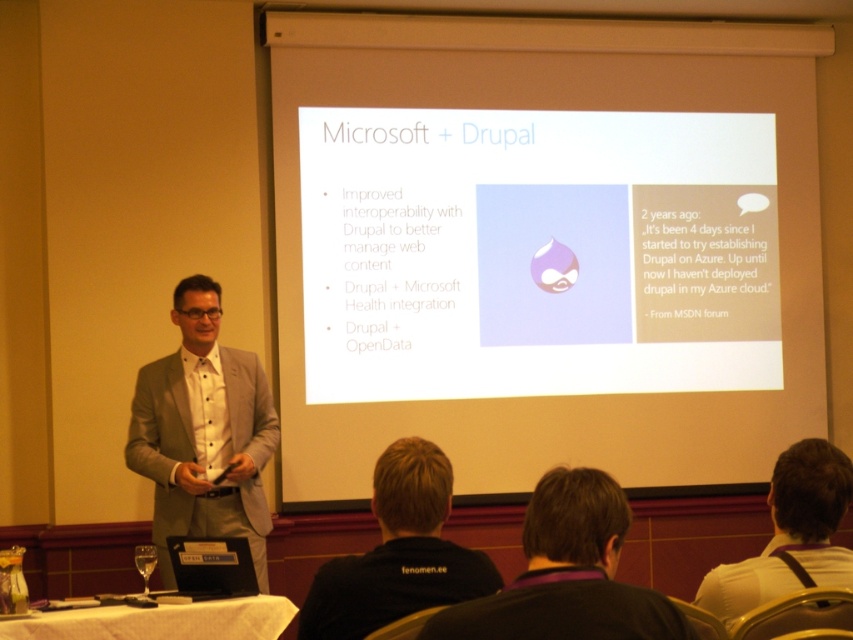
Which of these two, light gray suit at left or white fabric shirt at upper center, stands shorter?

With less height is white fabric shirt at upper center.

Does point (206, 292) come farther from viewer compared to point (815, 563)?

Yes, it is behind point (815, 563).

Identify the location of light gray suit at left. (202, 433).

Does light gray suit at left have a lesser width compared to dark brown hair at center?

Incorrect, light gray suit at left's width is not less than dark brown hair at center's.

Is the position of light gray suit at left less distant than that of dark brown hair at center?

No, light gray suit at left is further to the viewer.

Based on the photo, who is more forward, [242,412] or [593,508]?

Point [593,508]

At what (x,y) coordinates should I click in order to perform the action: click on light gray suit at left. Please return your answer as a coordinate pair (x, y). The width and height of the screenshot is (853, 640). Looking at the image, I should click on (202, 433).

Between dark brown hair at center and black fabric shirt at lower center, which one has more height?

Standing taller between the two is black fabric shirt at lower center.

Does dark brown hair at center appear under black fabric shirt at lower center?

No.

Who is more distant from viewer, (555,484) or (491,566)?

The point (491,566) is behind.

At what (x,y) coordinates should I click in order to perform the action: click on dark brown hair at center. Please return your answer as a coordinate pair (x, y). Looking at the image, I should click on (567, 573).